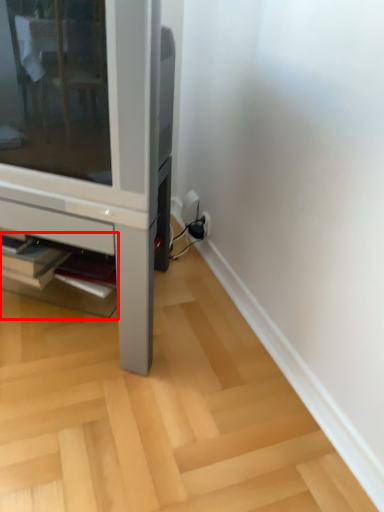
Question: From the image's perspective, what is the correct spatial positioning of shelf (annotated by the red box) in reference to furniture?

Choices:
 (A) below
 (B) above

Answer: (A)